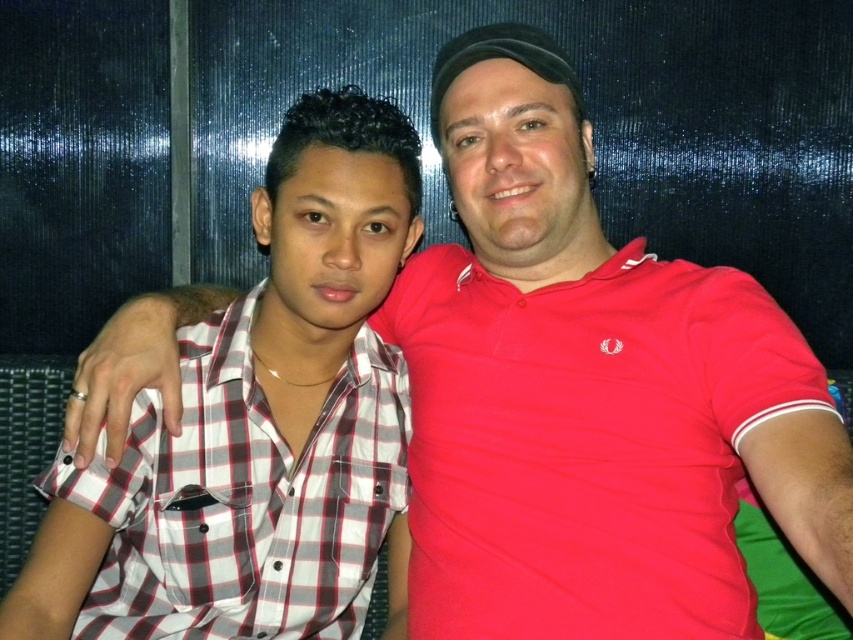
Is red cotton polo shirt at right wider than white checkered shirt at left?

Correct, the width of red cotton polo shirt at right exceeds that of white checkered shirt at left.

Can you confirm if red cotton polo shirt at right is positioned below white checkered shirt at left?

Correct, red cotton polo shirt at right is located below white checkered shirt at left.

Is point (708, 577) less distant than point (200, 444)?

That is True.

The width and height of the screenshot is (853, 640). Find the location of `red cotton polo shirt at right`. red cotton polo shirt at right is located at coordinates (585, 444).